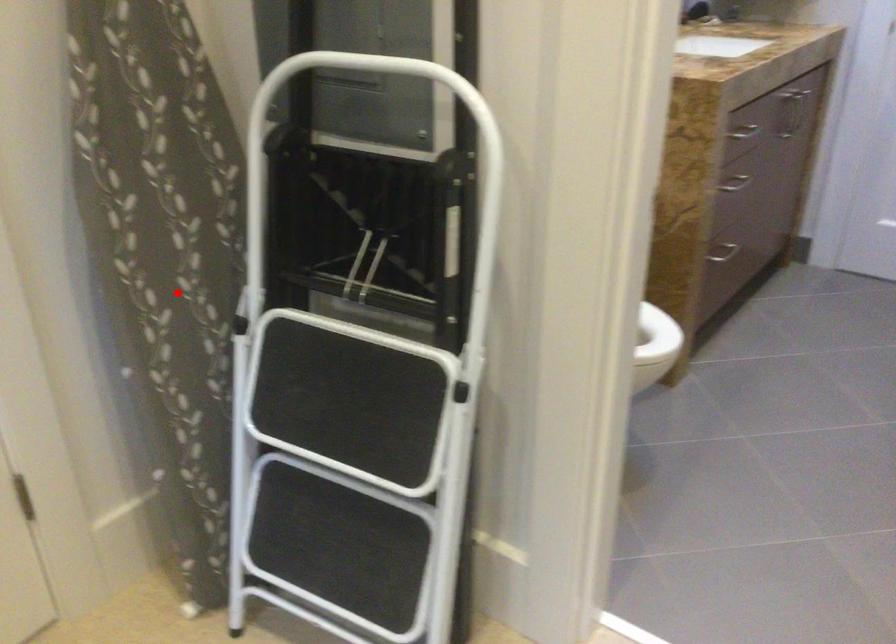
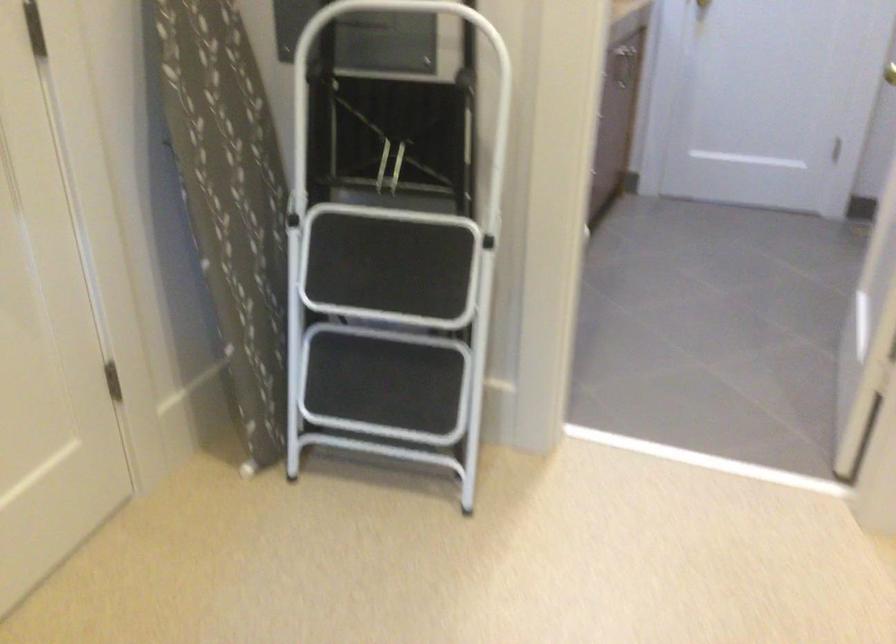
Locate, in the second image, the point that corresponds to the highlighted location in the first image.

(229, 199)